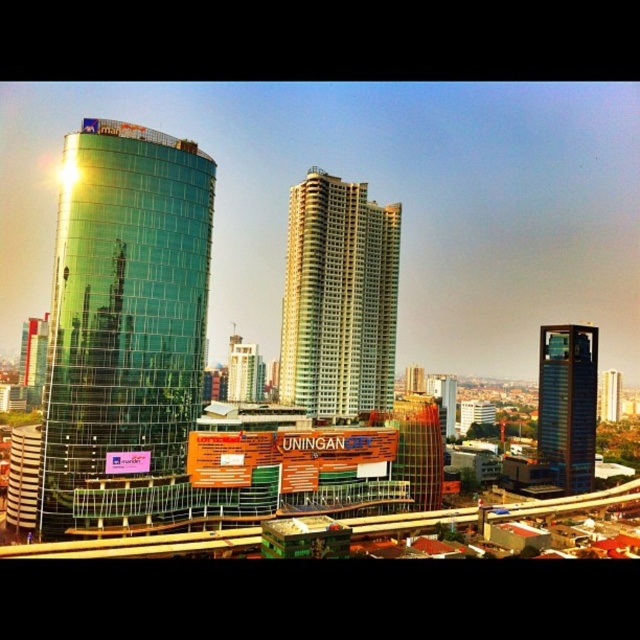
Question: Where is green glass tower at left located in relation to gold textured building at center in the image?

Choices:
 (A) left
 (B) right

Answer: (A)

Question: Does green glass tower at left appear on the left side of glassy blue skyscraper at right?

Choices:
 (A) no
 (B) yes

Answer: (B)

Question: Which point is closer to the camera?

Choices:
 (A) glassy blue skyscraper at right
 (B) green glass tower at left

Answer: (B)

Question: Which point appears closest to the camera in this image?

Choices:
 (A) (296, 236)
 (B) (614, 396)

Answer: (A)

Question: Which point is closer to the camera taking this photo?

Choices:
 (A) pyautogui.click(x=284, y=387)
 (B) pyautogui.click(x=576, y=456)

Answer: (A)

Question: Can you confirm if green glass tower at left is thinner than gold textured building at center?

Choices:
 (A) yes
 (B) no

Answer: (A)